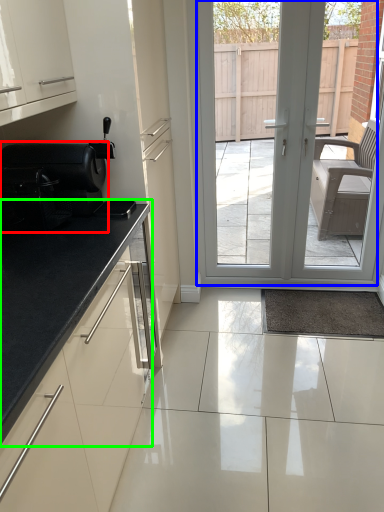
Question: Considering the real-world distances, which object is closest to appliance (highlighted by a red box)? door (highlighted by a blue box) or countertop (highlighted by a green box).

Choices:
 (A) door
 (B) countertop

Answer: (B)